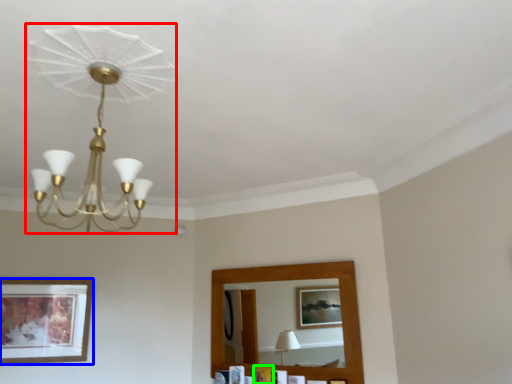
Question: Estimate the real-world distances between objects in this image. Which object is closer to lamp (highlighted by a red box), picture frame (highlighted by a blue box) or picture frame (highlighted by a green box)?

Choices:
 (A) picture frame
 (B) picture frame

Answer: (A)